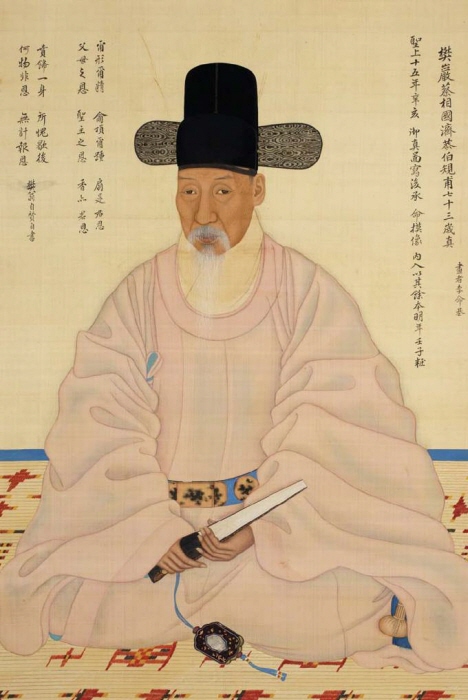
Where is `rug`? The height and width of the screenshot is (700, 468). rug is located at coordinates (104, 672).